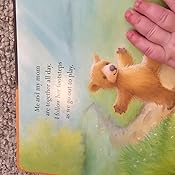
Find the location of a particular element. The height and width of the screenshot is (175, 175). floor is located at coordinates (9, 20), (5, 151).